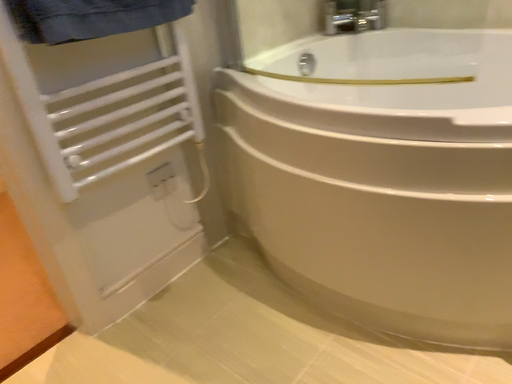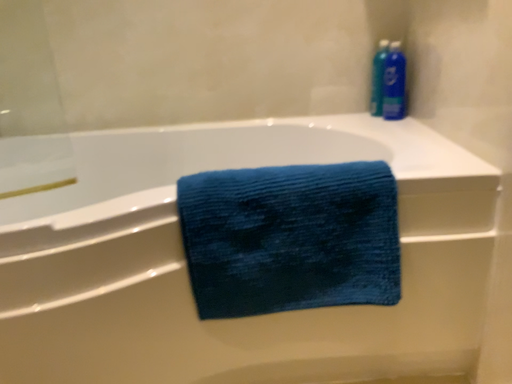
Question: Which way did the camera rotate in the video?

Choices:
 (A) rotated upward
 (B) rotated downward

Answer: (A)